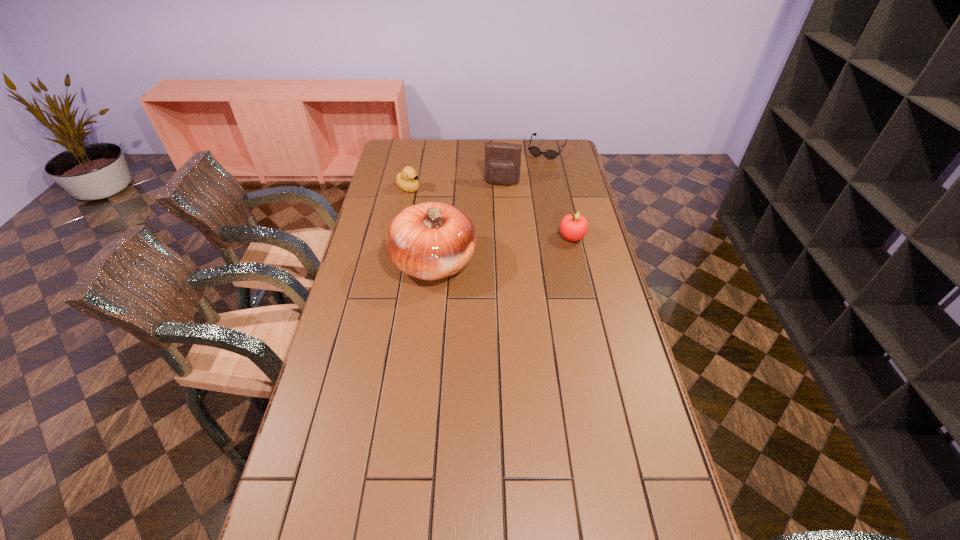
Locate an element on the screen. This screenshot has width=960, height=540. free space on the desktop that is between the tallest object and the apple and is positioned with an open flap on the third object from right to left is located at coordinates (490, 253).

At what (x,y) coordinates should I click in order to perform the action: click on free spot on the desktop that is between the tallest object and the apple and is positioned on the face of the duckling. Please return your answer as a coordinate pair (x, y). Looking at the image, I should click on (518, 247).

Find the location of `free spot on the desktop that is between the tallest object and the apple and is positioned on the lenses of the farthest object`. free spot on the desktop that is between the tallest object and the apple and is positioned on the lenses of the farthest object is located at coordinates (492, 252).